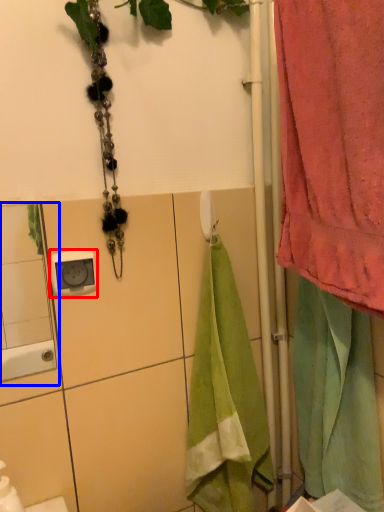
Question: Which of the following is the farthest to the observer, electric outlet (highlighted by a red box) or mirror (highlighted by a blue box)?

Choices:
 (A) electric outlet
 (B) mirror

Answer: (A)